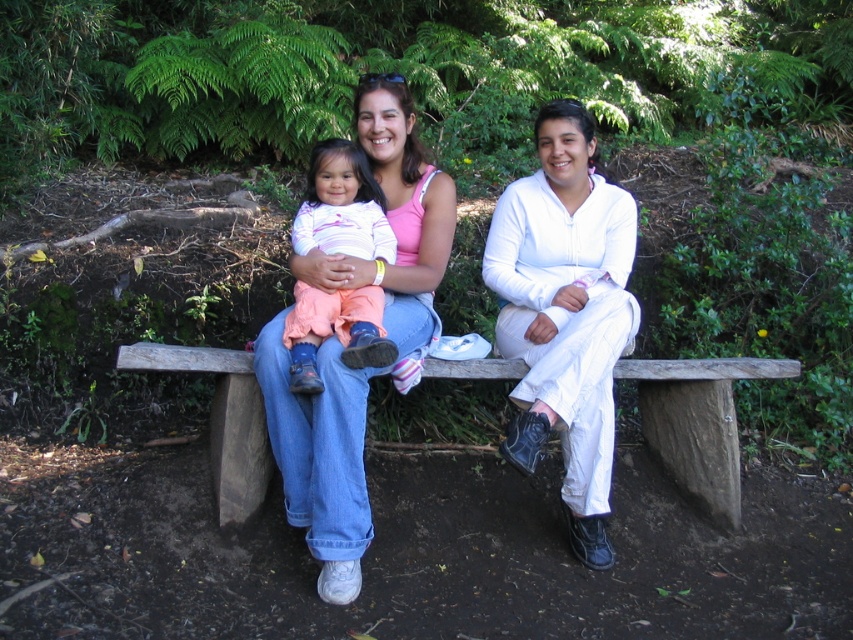
Based on the scene described, which object is positioned higher in relation to the other? Please refer to the objects listed below and ensure your answer includes at least one of them. Objects to consider are the white matte pants at center and the wooden bench at center.

The white matte pants at center is positioned above the wooden bench at center.

You are a photographer taking a picture of the scene. You notice the white matte pants at center and the matte pink tank top at center. Which clothing item is closer to the ground?

The white matte pants at center is positioned under the matte pink tank top at center, so the white matte pants at center is closer to the ground.